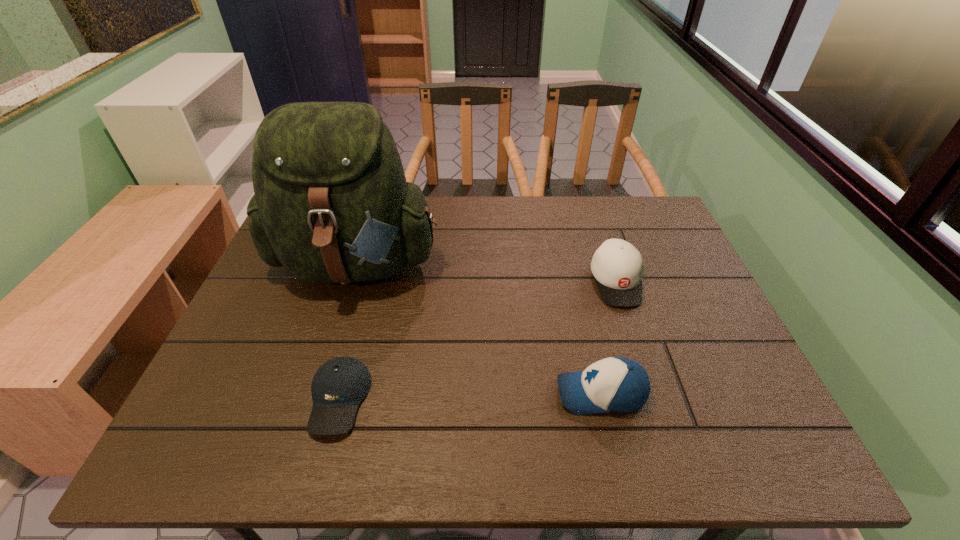
Identify which object is the nearest to the farthest baseball cap. Please provide its 2D coordinates. Your answer should be formatted as a tuple, i.e. [(x, y)], where the tuple contains the x and y coordinates of a point satisfying the conditions above.

[(619, 385)]

Where is `the closest baseball cap to the leftmost baseball cap`? This screenshot has height=540, width=960. the closest baseball cap to the leftmost baseball cap is located at coordinates (619, 385).

Identify which baseball cap is the second nearest to the farthest baseball cap. Please provide its 2D coordinates. Your answer should be formatted as a tuple, i.e. [(x, y)], where the tuple contains the x and y coordinates of a point satisfying the conditions above.

[(340, 384)]